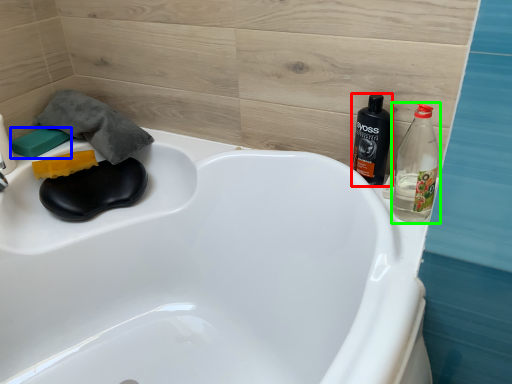
Question: Considering the real-world distances, which object is closest to bottle (highlighted by a red box)? soap (highlighted by a blue box) or bottle (highlighted by a green box).

Choices:
 (A) soap
 (B) bottle

Answer: (B)